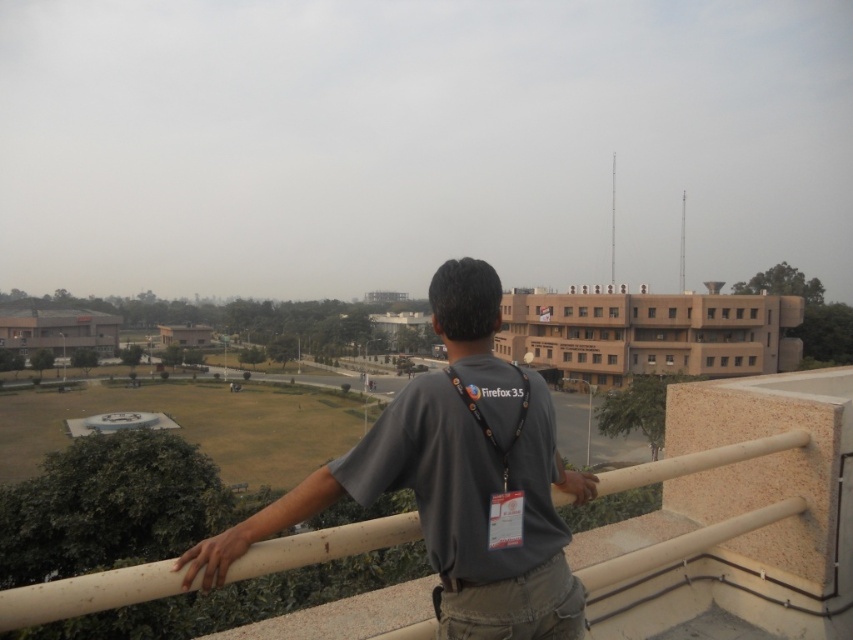
You are standing on the balcony and want to place a small plant pot between the two points, point (358, 444) and point (306, 541). Will the pot be closer to the railing or the edge of the balcony?

The pot will be closer to the railing because point (358, 444) is further to the camera than point (306, 541). Since the pot is placed between them, it will be closer to the point that is nearer to the railing, which is point (306, 541).

You are a photographer trying to capture the gray fabric shirt at center from a specific angle. The scene includes the person leaning against the balcony railing. Based on the coordinates provided in the description, can you determine if the shirt is positioned to the left or right of the center point of the image?

The gray fabric shirt at center is located at point 0.750 on the x axis and 0.533 on the y axis. Since the x coordinate is 0.750, which is greater than 0.5, the shirt is positioned to the right of the center point of the image.